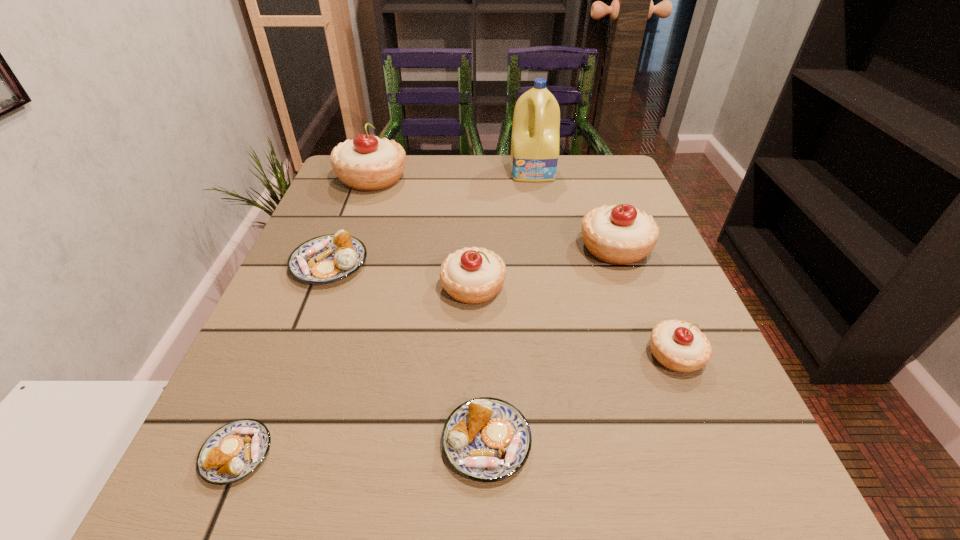
Locate an element on the screen. This screenshot has width=960, height=540. the closest brown pastry to the third biggest beige pastry is located at coordinates (328, 258).

Locate an element on the screen. vacant space that satisfies the following two spatial constraints: 1. on the front side of the rightmost brown pastry; 2. on the left side of the fifth shortest object is located at coordinates (470, 442).

You are a GUI agent. You are given a task and a screenshot of the screen. Output one action in this format:
    pyautogui.click(x=<x>, y=<y>)
    Task: Click on the vacant region that satisfies the following two spatial constraints: 1. on the back side of the fifth tallest pastry; 2. on the left side of the tallest pastry
    The height and width of the screenshot is (540, 960).
    Given the screenshot: What is the action you would take?
    pyautogui.click(x=363, y=178)

Find the location of a particular element. vacant space that satisfies the following two spatial constraints: 1. on the back side of the shortest object; 2. on the right side of the nearest beige pastry is located at coordinates (279, 355).